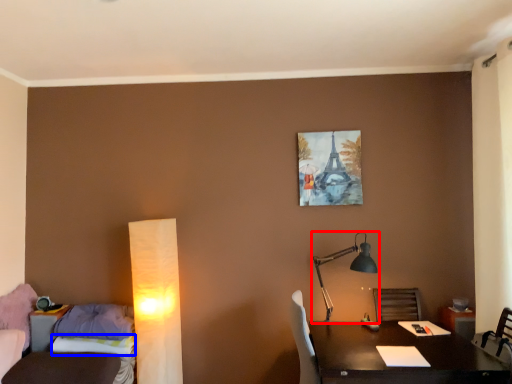
Question: Which point is closer to the camera, lamp (highlighted by a red box) or sheet (highlighted by a blue box)?

Choices:
 (A) lamp
 (B) sheet

Answer: (A)